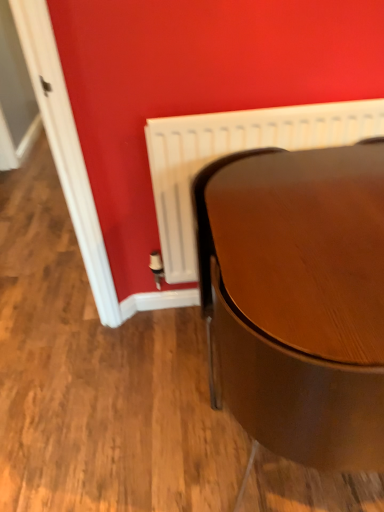
Question: Is white plastic radiator at center wider or thinner than glossy wood table at lower right?

Choices:
 (A) wide
 (B) thin

Answer: (B)

Question: Is white plastic radiator at center taller or shorter than glossy wood table at lower right?

Choices:
 (A) tall
 (B) short

Answer: (B)

Question: Considering the positions of white plastic radiator at center and glossy wood table at lower right in the image, is white plastic radiator at center bigger or smaller than glossy wood table at lower right?

Choices:
 (A) small
 (B) big

Answer: (A)

Question: Is glossy wood table at lower right in front of or behind white plastic radiator at center in the image?

Choices:
 (A) behind
 (B) front

Answer: (B)

Question: Is glossy wood table at lower right taller or shorter than white plastic radiator at center?

Choices:
 (A) tall
 (B) short

Answer: (A)

Question: From the image's perspective, is glossy wood table at lower right above or below white plastic radiator at center?

Choices:
 (A) above
 (B) below

Answer: (B)

Question: Considering the positions of glossy wood table at lower right and white plastic radiator at center in the image, is glossy wood table at lower right wider or thinner than white plastic radiator at center?

Choices:
 (A) thin
 (B) wide

Answer: (B)